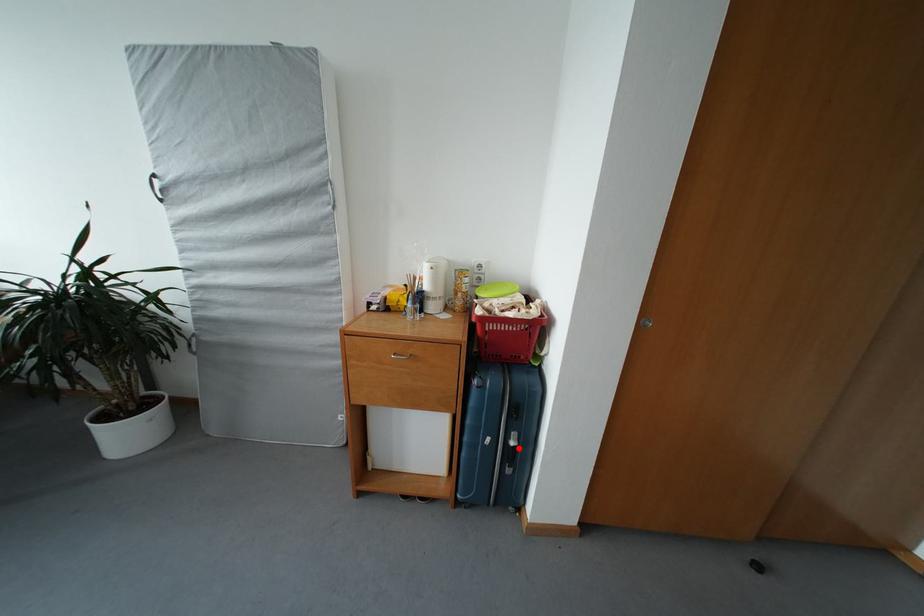
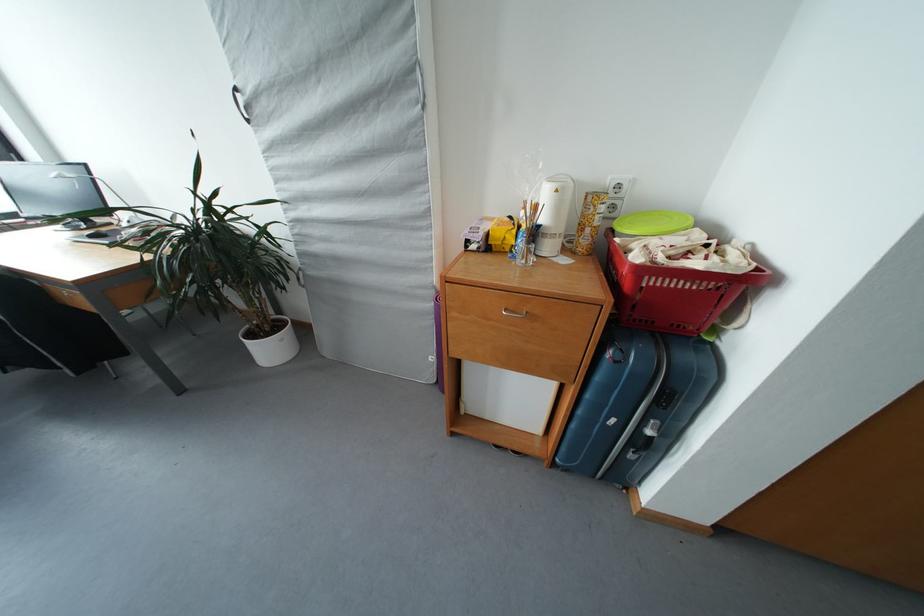
Locate, in the second image, the point that corresponds to the highlighted location in the first image.

(655, 437)